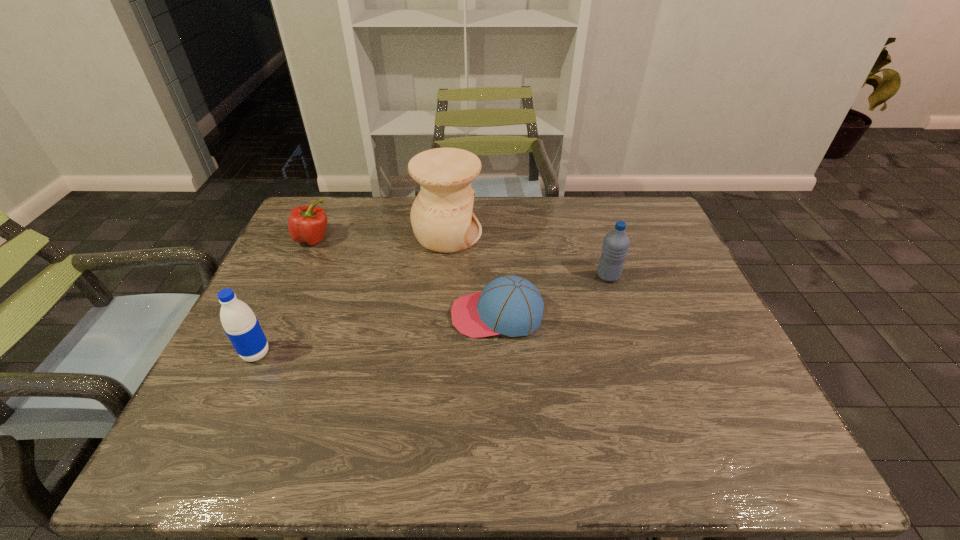
Find the location of `blank area in the image that satisfies the following two spatial constraints: 1. at the open side of the tallest object; 2. on the front side of the bell pepper`. blank area in the image that satisfies the following two spatial constraints: 1. at the open side of the tallest object; 2. on the front side of the bell pepper is located at coordinates (447, 239).

Identify the location of vacant region that satisfies the following two spatial constraints: 1. on the back side of the nearer water bottle; 2. on the left side of the rightmost object. This screenshot has width=960, height=540. (293, 276).